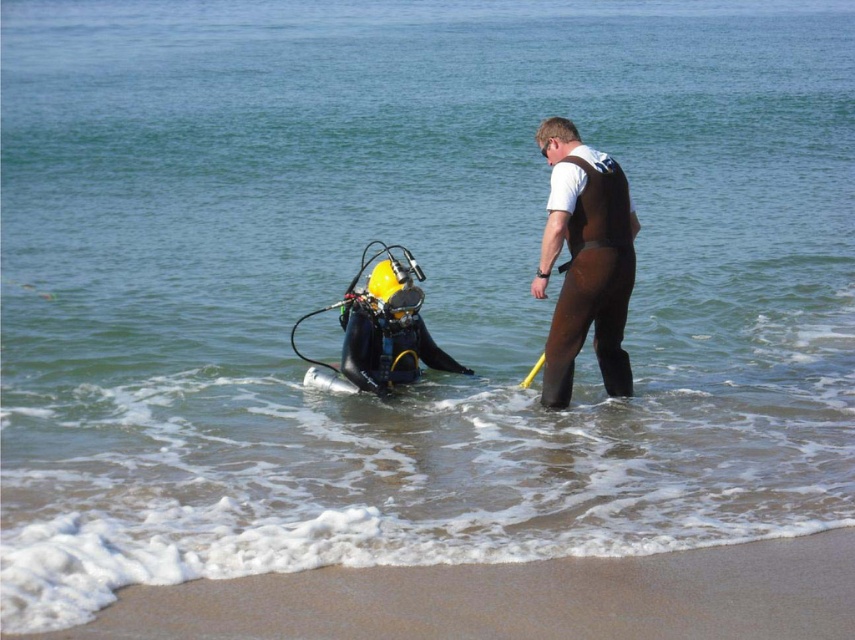
Is sandy beach at lower left smaller than brown matte wetsuit at center?

Yes, sandy beach at lower left is smaller than brown matte wetsuit at center.

Can you confirm if sandy beach at lower left is bigger than brown matte wetsuit at center?

Actually, sandy beach at lower left might be smaller than brown matte wetsuit at center.

What do you see at coordinates (514, 600) in the screenshot? I see `sandy beach at lower left` at bounding box center [514, 600].

Where is `sandy beach at lower left`? This screenshot has height=640, width=855. sandy beach at lower left is located at coordinates (514, 600).